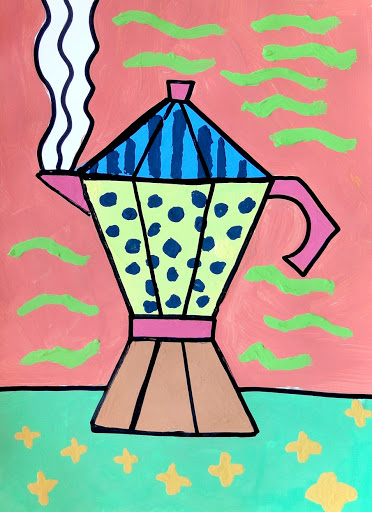
The image size is (372, 512). Find the location of `orange wallpaper`. orange wallpaper is located at coordinates tap(223, 98).